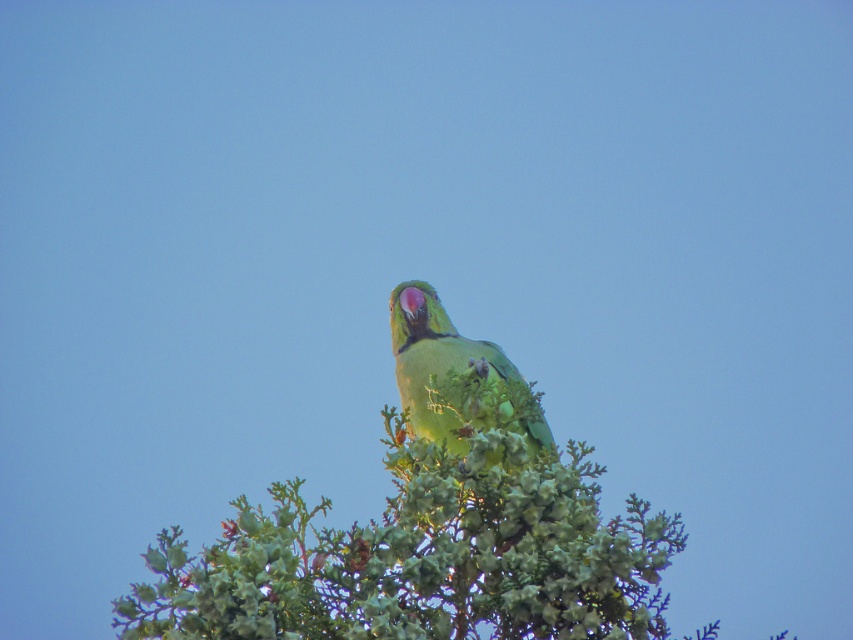
Is point (506, 390) positioned in front of point (451, 401)?

Yes, point (506, 390) is in front of point (451, 401).

Consider the image. Is green leafy tree at center shorter than green matte parrot at center?

No, green leafy tree at center is not shorter than green matte parrot at center.

Does point (590, 632) lie behind point (434, 438)?

No, (590, 632) is in front of (434, 438).

You are a GUI agent. You are given a task and a screenshot of the screen. Output one action in this format:
    pyautogui.click(x=<x>, y=<y>)
    Task: Click on the green leafy tree at center
    The image size is (853, 640).
    Given the screenshot: What is the action you would take?
    pyautogui.click(x=426, y=548)